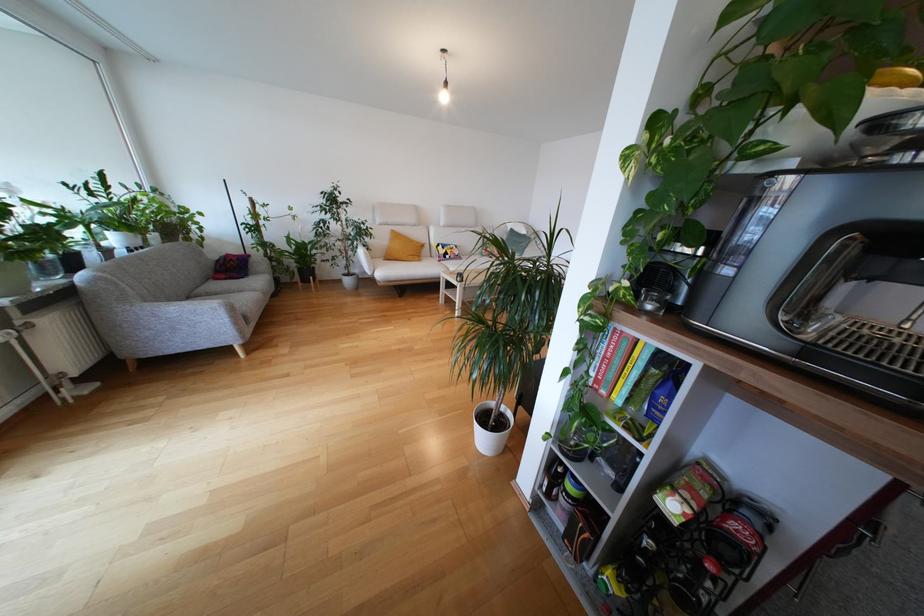
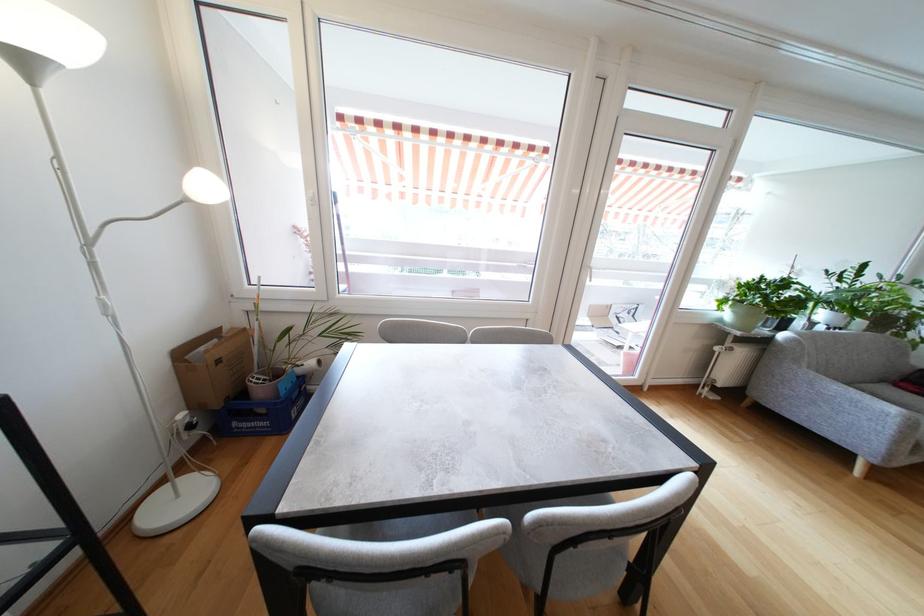
Find the pixel in the second image that matches the point at 201,292 in the first image.

(866, 387)